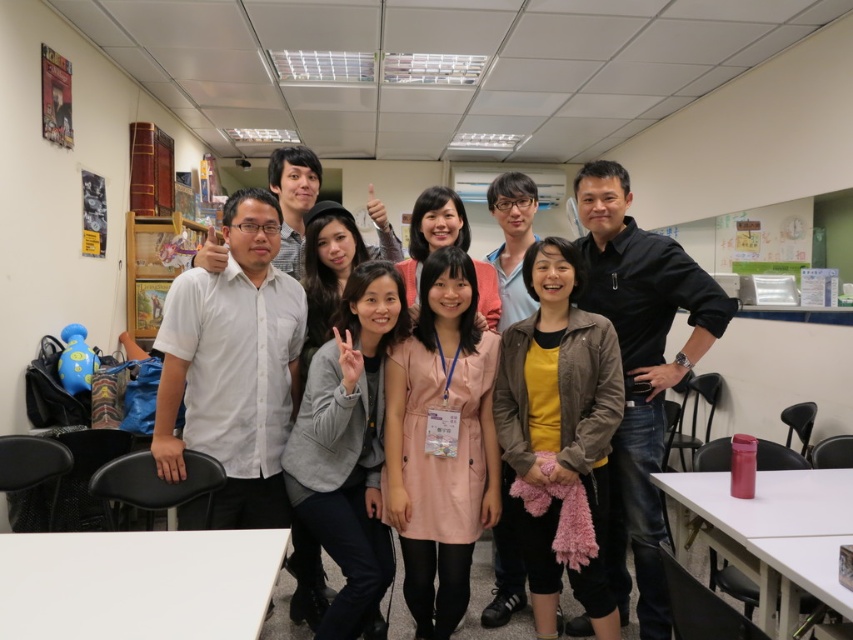
Locate an element on the screen. Image resolution: width=853 pixels, height=640 pixels. pink fabric dress at center is located at coordinates (440, 442).

Can you confirm if gray fabric jacket at center is positioned below wooden bookshelf at left?

Yes, gray fabric jacket at center is below wooden bookshelf at left.

Is point (405, 314) behind point (171, 260)?

No, it is in front of (171, 260).

Image resolution: width=853 pixels, height=640 pixels. What are the coordinates of `gray fabric jacket at center` in the screenshot? It's located at (347, 445).

Is brown leather jacket at center to the right of pink fabric at center from the viewer's perspective?

Yes, brown leather jacket at center is to the right of pink fabric at center.

Measure the distance between brown leather jacket at center and pink fabric at center.

brown leather jacket at center and pink fabric at center are 19.88 inches apart from each other.

The image size is (853, 640). Find the location of `brown leather jacket at center`. brown leather jacket at center is located at coordinates (561, 404).

Find the location of a particular element. brown leather jacket at center is located at coordinates (561, 404).